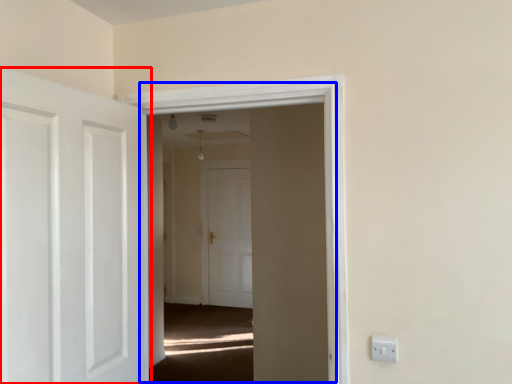
Question: Which point is closer to the camera, door (highlighted by a red box) or window (highlighted by a blue box)?

Choices:
 (A) door
 (B) window

Answer: (A)